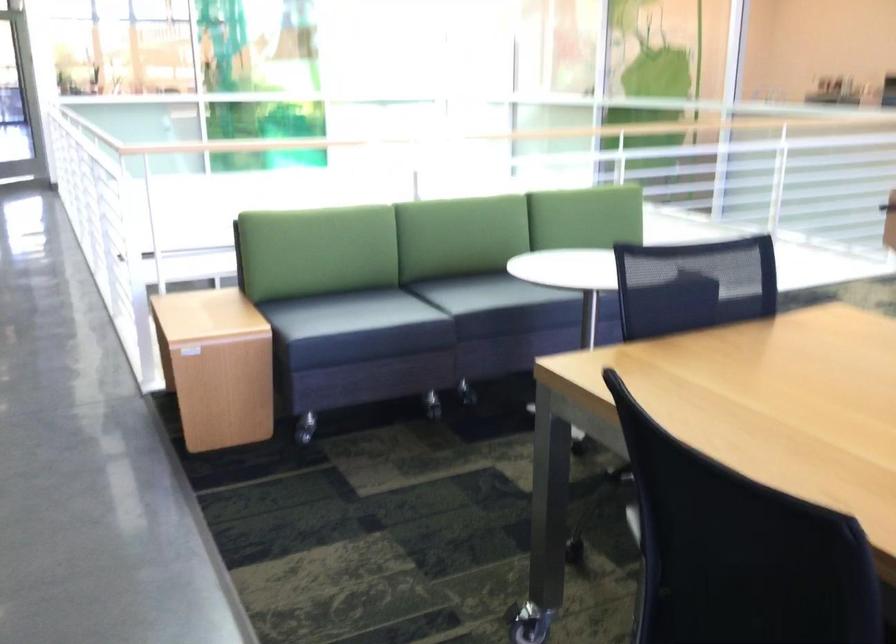
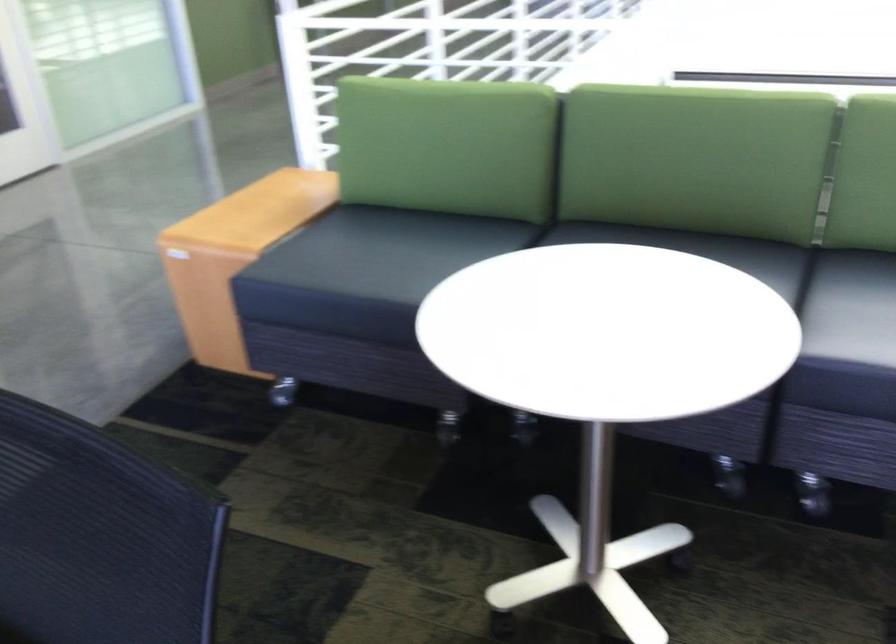
The point at [427,269] is marked in the first image. Where is the corresponding point in the second image?

(702, 250)